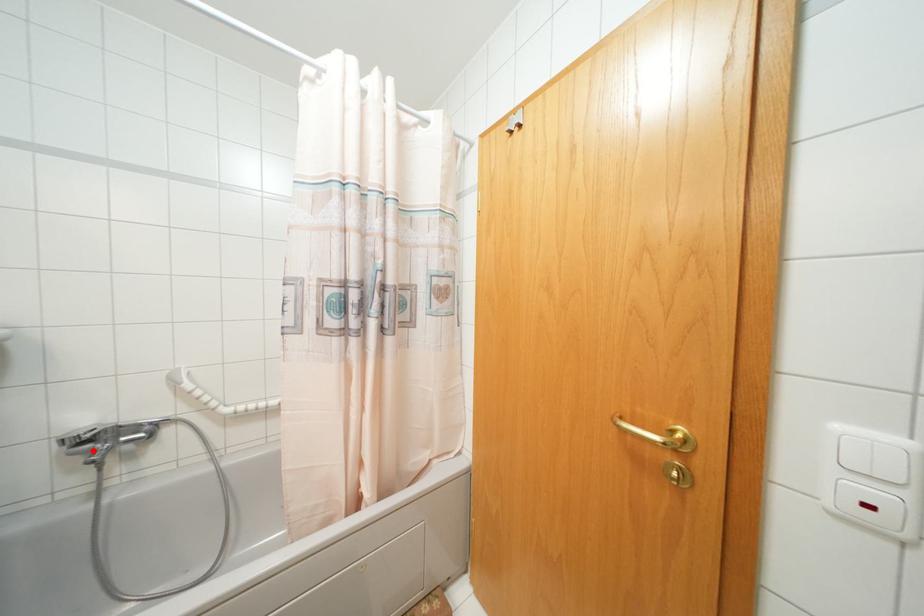
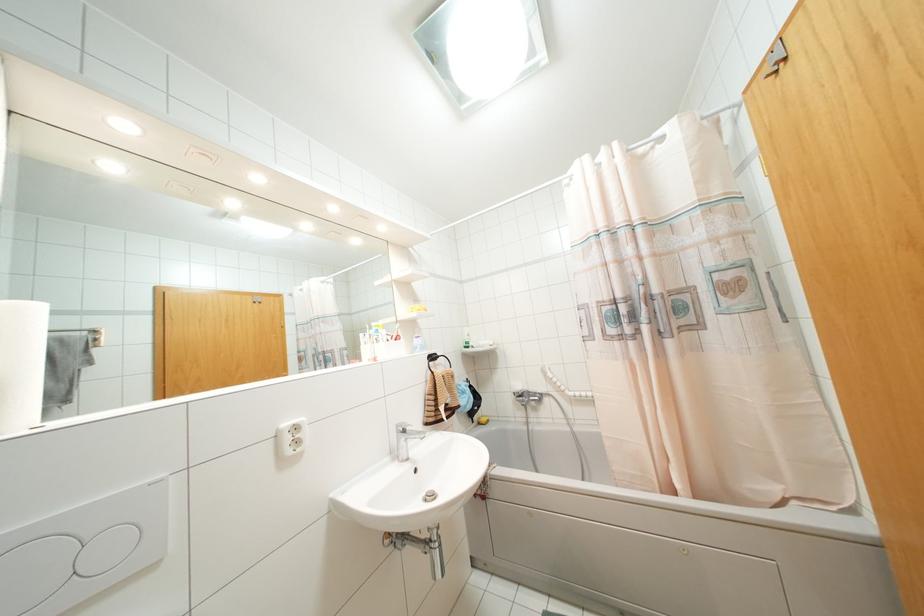
Question: A red point is marked in image1. In image2, is the corresponding 3D point closer to the camera or farther? Reply with the corresponding letter.

Choices:
 (A) The corresponding 3D point is closer.
 (B) The corresponding 3D point is farther.

Answer: (B)